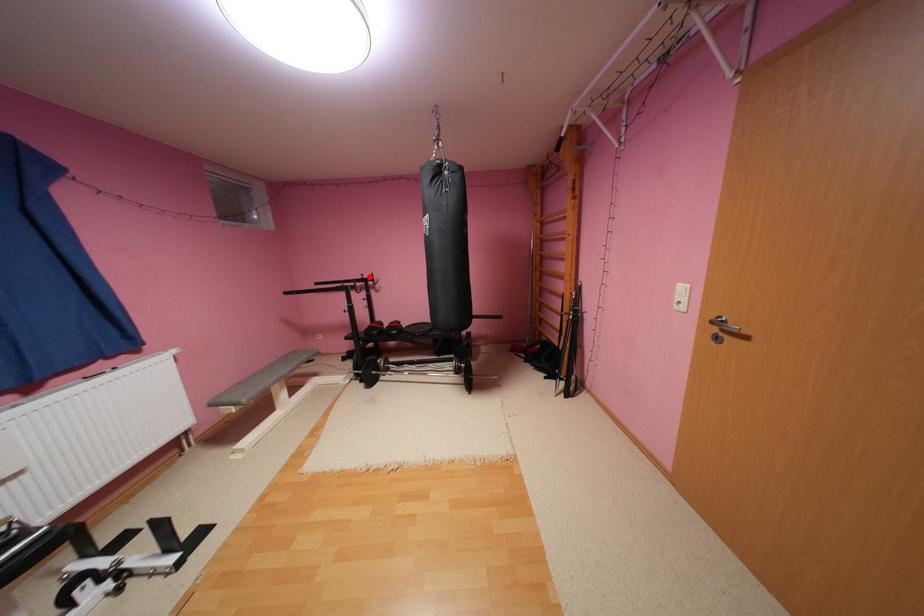
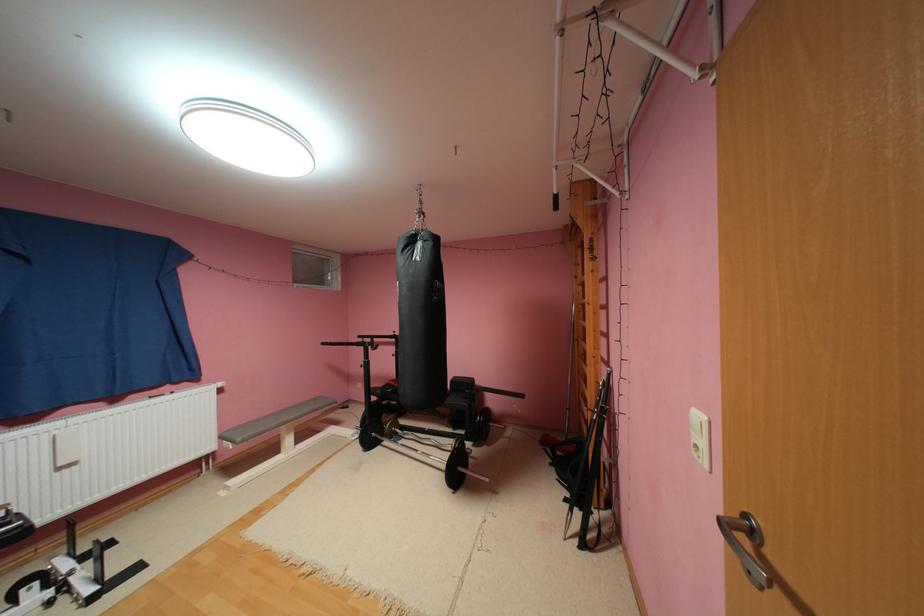
Locate, in the second image, the point that corresponds to the highlighted location in the first image.

(400, 334)